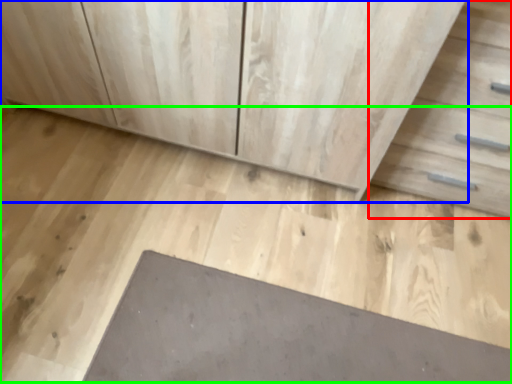
Question: Estimate the real-world distances between objects in this image. Which object is closer to drawer (highlighted by a red box), chest of drawers (highlighted by a blue box) or concrete (highlighted by a green box)?

Choices:
 (A) chest of drawers
 (B) concrete

Answer: (A)